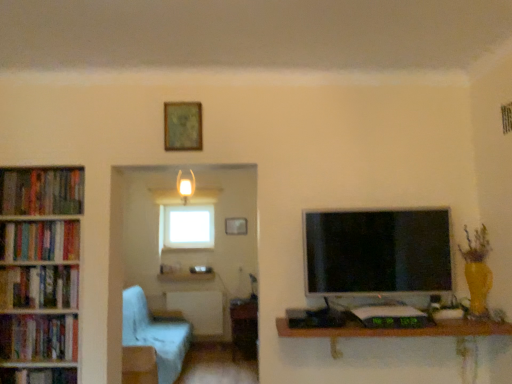
Question: Should I look upward or downward to see hardcover books at left, the third book in the bottom-to-top sequence?

Choices:
 (A) up
 (B) down

Answer: (B)

Question: Is matte glass lampshade at upper center taller than light blue fabric armchair at left?

Choices:
 (A) no
 (B) yes

Answer: (A)

Question: Is matte glass lampshade at upper center behind light blue fabric armchair at left?

Choices:
 (A) yes
 (B) no

Answer: (A)

Question: From a real-world perspective, is matte glass lampshade at upper center positioned under light blue fabric armchair at left based on gravity?

Choices:
 (A) no
 (B) yes

Answer: (A)

Question: From the image's perspective, is matte glass lampshade at upper center on light blue fabric armchair at left?

Choices:
 (A) no
 (B) yes

Answer: (B)

Question: Considering the relative sizes of matte glass lampshade at upper center and light blue fabric armchair at left in the image provided, is matte glass lampshade at upper center smaller than light blue fabric armchair at left?

Choices:
 (A) no
 (B) yes

Answer: (B)

Question: Can you confirm if matte glass lampshade at upper center is bigger than light blue fabric armchair at left?

Choices:
 (A) no
 (B) yes

Answer: (A)

Question: Is hardcover books at left, the third book in the bottom-to-top sequence, to the left of wooden table at center, which ranks as the first table in bottom-to-top order, from the viewer's perspective?

Choices:
 (A) yes
 (B) no

Answer: (A)

Question: From a real-world perspective, is hardcover books at left, the third book in the bottom-to-top sequence, physically above wooden table at center, the 1th table from the back?

Choices:
 (A) no
 (B) yes

Answer: (B)

Question: Is hardcover books at left, the 3th book viewed from the top, positioned behind wooden table at center, marked as the second table in a right-to-left arrangement?

Choices:
 (A) no
 (B) yes

Answer: (A)

Question: Is hardcover books at left, the third book in the bottom-to-top sequence, in front of wooden table at center, arranged as the second table when viewed from the front?

Choices:
 (A) no
 (B) yes

Answer: (B)

Question: Considering the relative sizes of hardcover books at left, the 3th book viewed from the top, and wooden table at center, arranged as the second table when viewed from the front, in the image provided, is hardcover books at left, the 3th book viewed from the top, shorter than wooden table at center, arranged as the second table when viewed from the front,?

Choices:
 (A) no
 (B) yes

Answer: (B)

Question: Is hardcover books at left, the third book in the bottom-to-top sequence, bigger than wooden table at center, the 1th table from the back?

Choices:
 (A) no
 (B) yes

Answer: (A)

Question: Are wooden table at center, the 1th table viewed from the left, and hardcover books at left, which appears as the 1th book when viewed from the top, making contact?

Choices:
 (A) yes
 (B) no

Answer: (B)